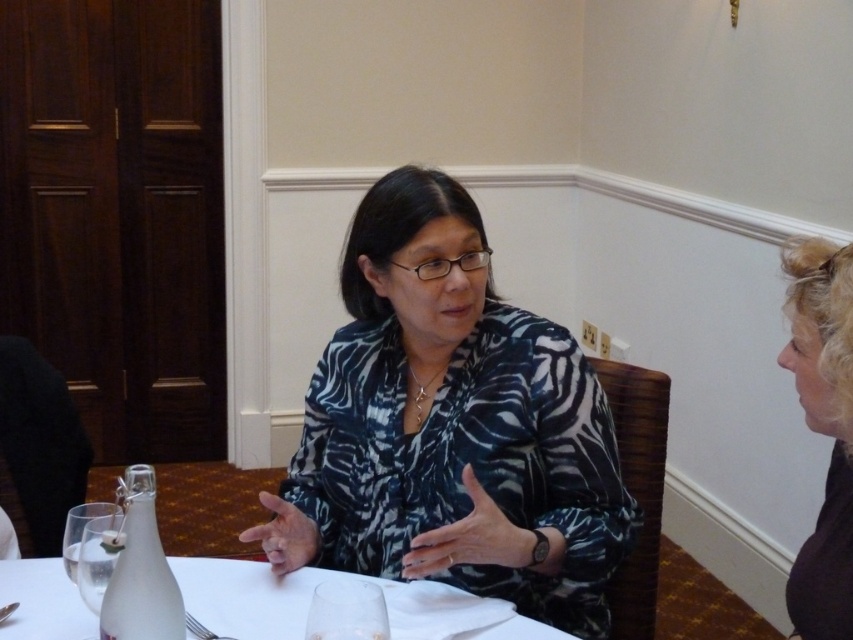
Who is higher up, clear glass at center or clear glass wine glass at lower left?

clear glass wine glass at lower left

Locate an element on the screen. clear glass at center is located at coordinates (346, 611).

Who is lower down, blonde hair at right or white frosted glass at center?

Positioned lower is white frosted glass at center.

Who is positioned more to the left, blonde hair at right or white frosted glass at center?

Positioned to the left is white frosted glass at center.

This screenshot has height=640, width=853. I want to click on blonde hair at right, so click(x=822, y=429).

Which is in front, point (13, 570) or point (367, 604)?

Point (367, 604) is more forward.

From the picture: Does white frosted glass at center have a greater width compared to clear glass at center?

Indeed, white frosted glass at center has a greater width compared to clear glass at center.

Between point (12, 627) and point (335, 627), which one is positioned in front?

Point (335, 627) is more forward.

Locate an element on the screen. The width and height of the screenshot is (853, 640). white frosted glass at center is located at coordinates (251, 595).